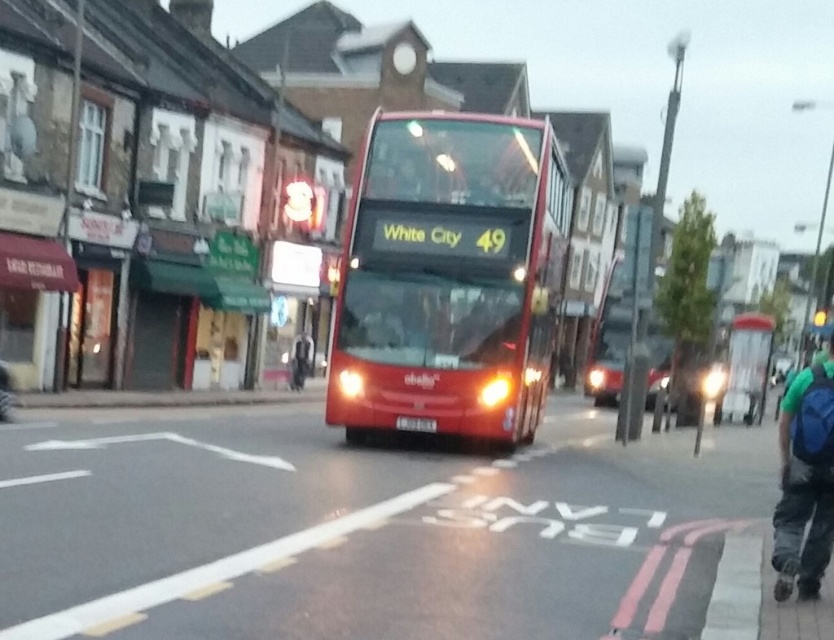
Which is more to the right, shiny red bus at center or blue backpack at lower right?

Positioned to the right is blue backpack at lower right.

Who is taller, shiny red bus at center or blue backpack at lower right?

blue backpack at lower right is taller.

Locate an element on the screen. Image resolution: width=834 pixels, height=640 pixels. shiny red bus at center is located at coordinates (450, 276).